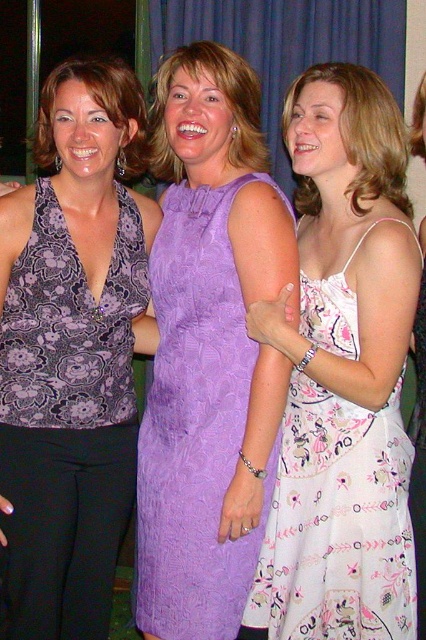
You are taking a photo of three women standing indoors. You notice two points in the scene at coordinates point (x=51, y=380) and point (x=164, y=132). Which point is nearer to the camera?

Point (x=51, y=380) is closer to the camera than point (x=164, y=132).

You are a photographer adjusting the camera settings for a group photo. You notice two dresses in the scene, the white floral dress at center and the matte purple dress at center. Which dress should you focus on first if you want to ensure both are in sharp focus, considering their heights?

The white floral dress at center is taller than the matte purple dress at center, so focusing on the taller white floral dress at center first would help ensure both are in sharp focus since it is the higher point in the composition.

You are a photographer setting up for a group photo. You want to ensure that the white floral dress at center and the purple fabric curtain at upper center are both visible in the frame. Given their sizes, which object should you focus on to make sure both are in the shot?

The white floral dress at center occupies less space than the purple fabric curtain at upper center, so you should focus on the purple fabric curtain at upper center to ensure both are in the frame since it takes up more space and requires a wider angle.